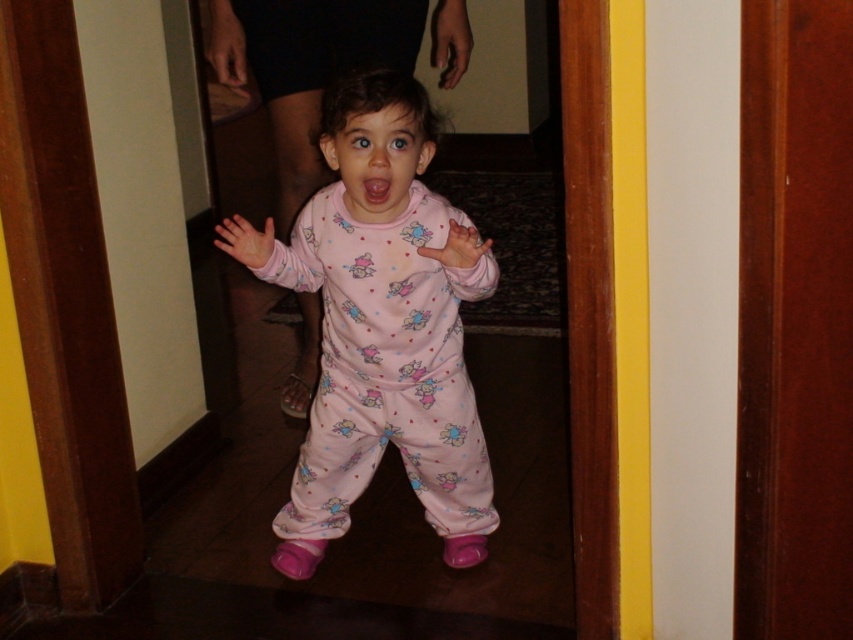
Question: Which point is farther to the camera?

Choices:
 (A) pink cotton pajamas at center
 (B) pink matte mouth at center
 (C) wooden door at center

Answer: (B)

Question: Is pink cotton pajamas at center to the left of pink matte mouth at center from the viewer's perspective?

Choices:
 (A) yes
 (B) no

Answer: (A)

Question: Which of the following is the closest to the observer?

Choices:
 (A) (836, 84)
 (B) (363, 198)

Answer: (A)

Question: Observing the image, what is the correct spatial positioning of wooden door at center in reference to pink matte mouth at center?

Choices:
 (A) below
 (B) above

Answer: (A)

Question: Which of the following is the closest to the observer?

Choices:
 (A) pink cotton pajamas at center
 (B) pink matte mouth at center

Answer: (A)

Question: Is pink cotton pajamas at center above wooden door at center?

Choices:
 (A) yes
 (B) no

Answer: (B)